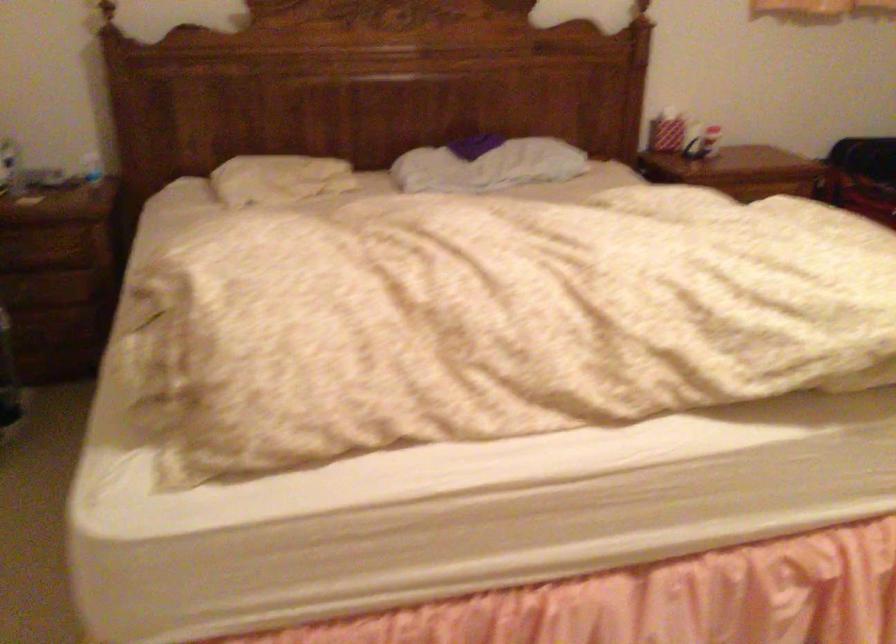
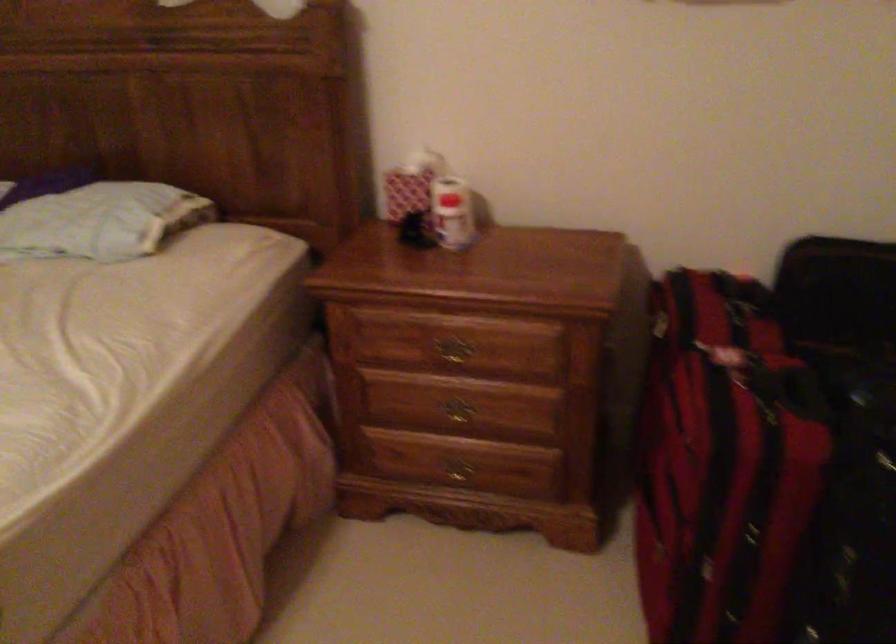
Where in the second image is the point corresponding to (669,118) from the first image?

(410, 184)